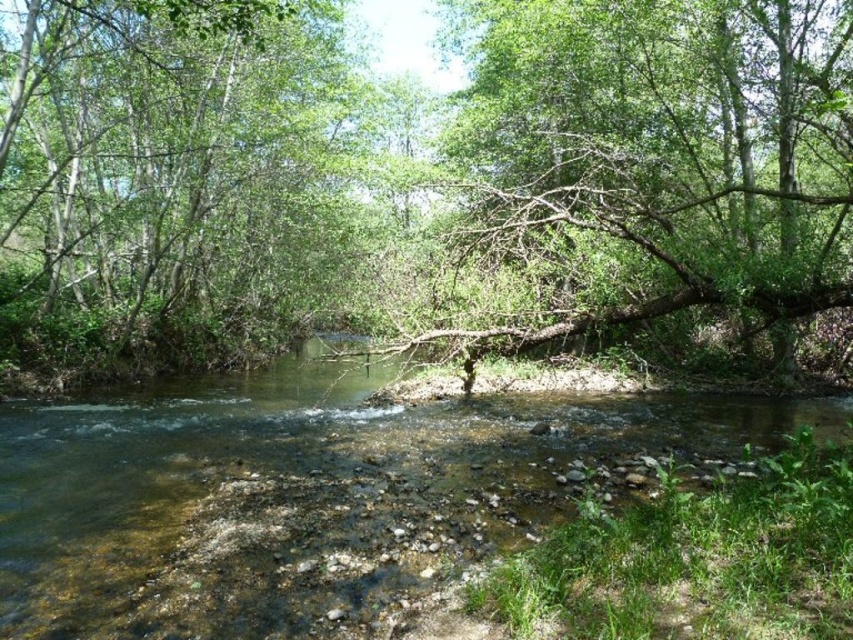
Question: Where is brown rough tree trunk at center located in relation to green leafy tree at left in the image?

Choices:
 (A) below
 (B) above

Answer: (A)

Question: Can you confirm if clear water at center is thinner than green leafy tree at left?

Choices:
 (A) no
 (B) yes

Answer: (A)

Question: Which point is closer to the camera taking this photo?

Choices:
 (A) (541, 257)
 (B) (285, 125)
 (C) (283, 572)

Answer: (C)

Question: Among these objects, which one is farthest from the camera?

Choices:
 (A) clear water at center
 (B) brown rough tree trunk at center

Answer: (B)

Question: Can you confirm if brown rough tree trunk at center is positioned to the left of green leafy tree at left?

Choices:
 (A) yes
 (B) no

Answer: (B)

Question: Which point is closer to the camera?

Choices:
 (A) (286, 148)
 (B) (440, 333)

Answer: (B)